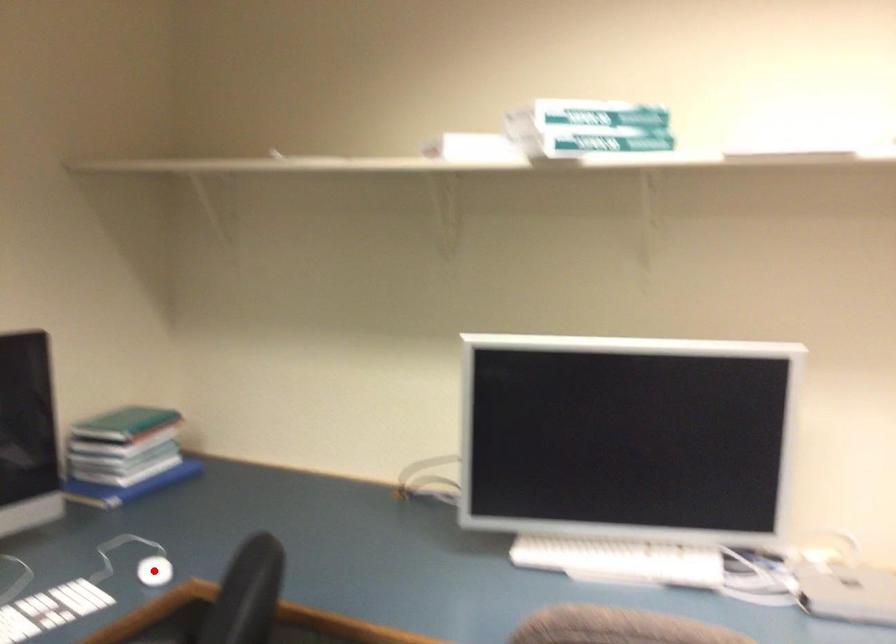
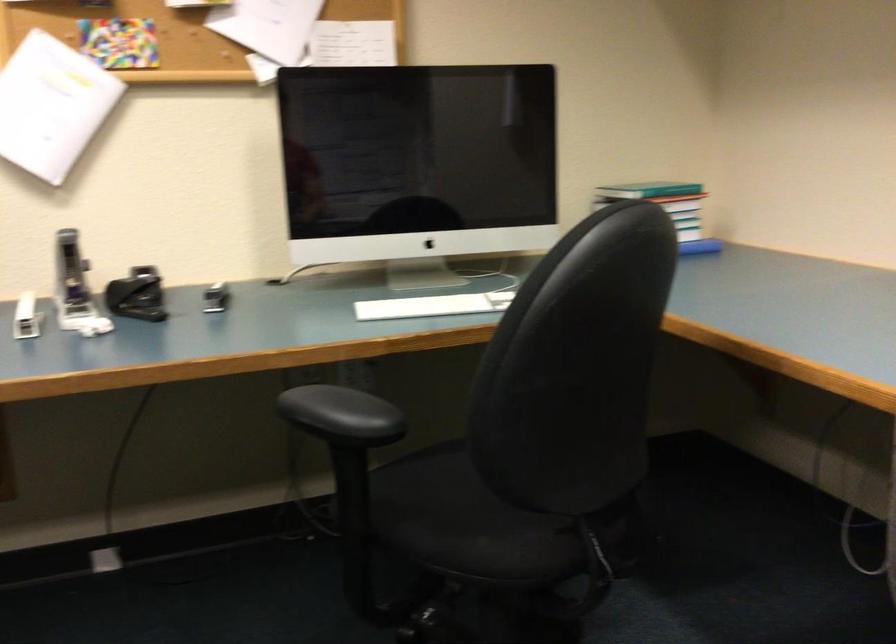
Question: I am providing you with two images of the same scene from different viewpoints. A red point is marked on the first image. At the location where the point appears in image 1, is it still visible in image 2?

Choices:
 (A) Yes
 (B) No

Answer: (B)